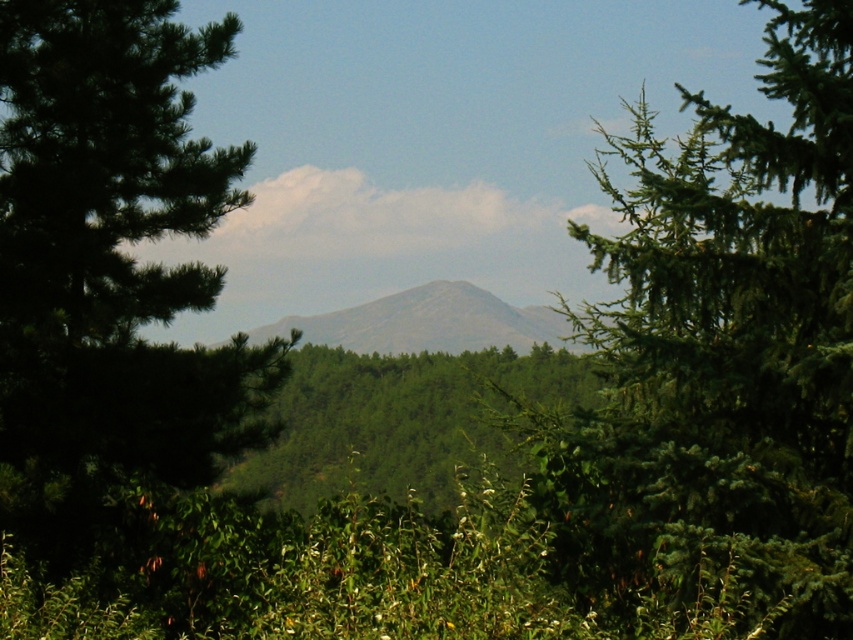
In the scene shown: You are standing at the point marked as point (x=846, y=308) in the image. There is a hidden treasure buried exactly 8 meters away from your current position. Can you reach the treasure without leaving the forest area shown in the image?

Yes, since the distance between you and the treasure is exactly 8 meters, which matches the 8.02 meters mentioned in the description, you can reach the treasure while staying within the forest area shown in the image.

You are standing in the serene natural landscape described. You notice a specific point marked at coordinates [718,365]. What object is located at this point?

The green needle like at right is located at point [718,365].